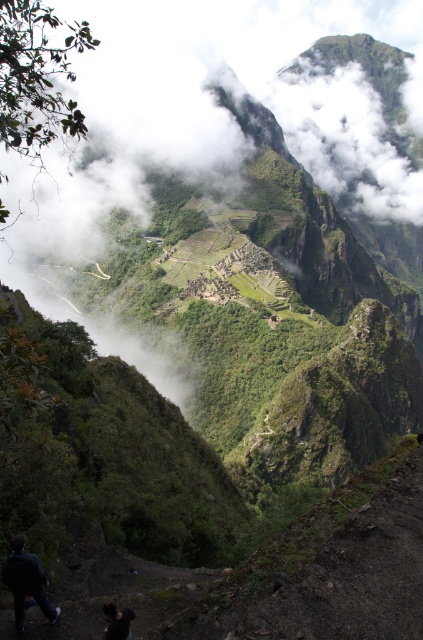
Which is below, dark blue jacket at lower left or dark brown hair at lower left?

dark brown hair at lower left

Can you confirm if dark blue jacket at lower left is taller than dark brown hair at lower left?

Correct, dark blue jacket at lower left is much taller as dark brown hair at lower left.

The width and height of the screenshot is (423, 640). I want to click on dark blue jacket at lower left, so click(x=25, y=580).